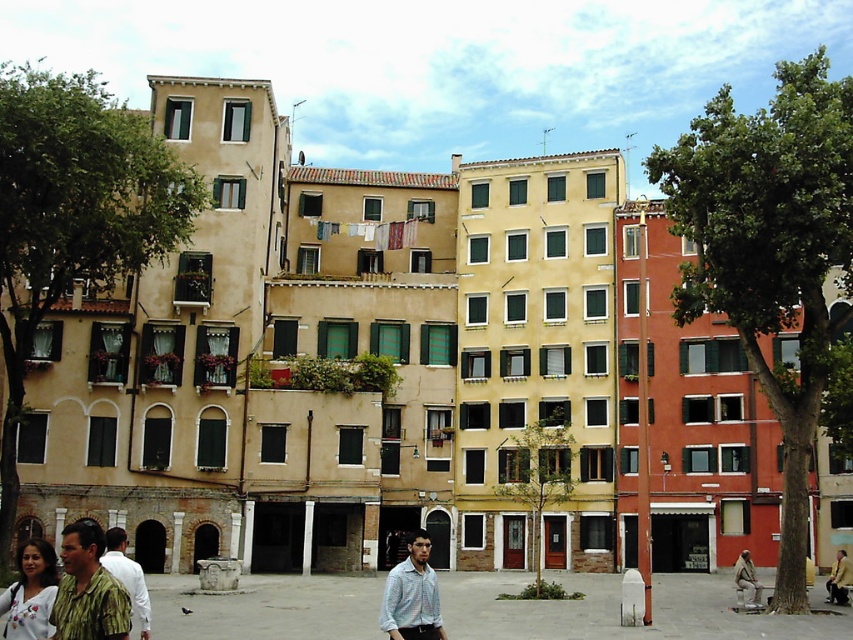
You are a tourist walking along the street and notice two pieces of clothing hanging on a clothesline between two buildings. The light blue shirt at center and the white embroidered blouse at lower left. Which one is hanging lower?

The light blue shirt at center is positioned under the white embroidered blouse at lower left, so it is hanging lower.

You are a tourist walking along the street and spot both the light blue shirt at center and the white embroidered blouse at lower left. Which one is closer to you?

The light blue shirt at center is closer to you because the white embroidered blouse at lower left is behind it.

You are a tourist standing in the street scene and you see a point at coordinate (30, 593). What object is this point located on?

The point at coordinate (30, 593) is located on the white embroidered blouse at lower left.